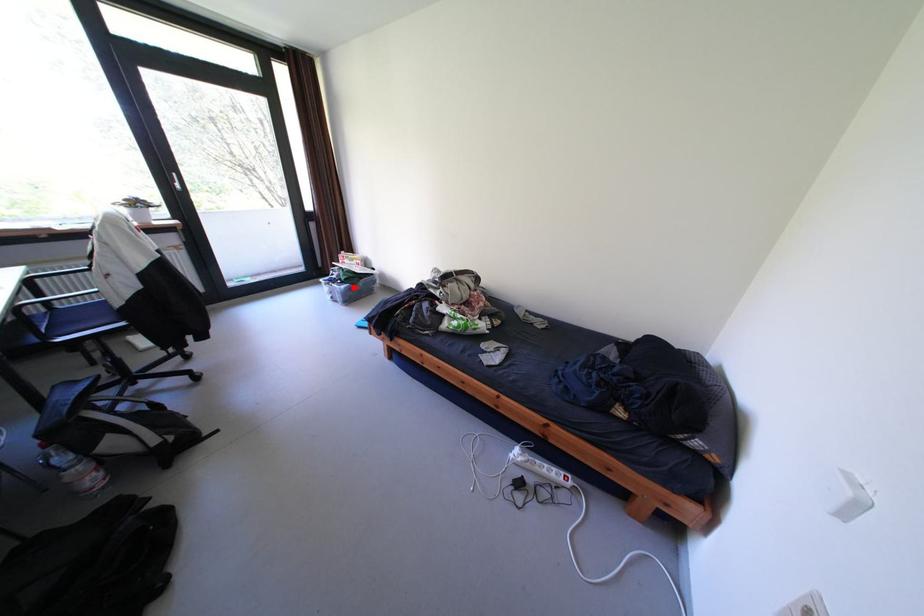
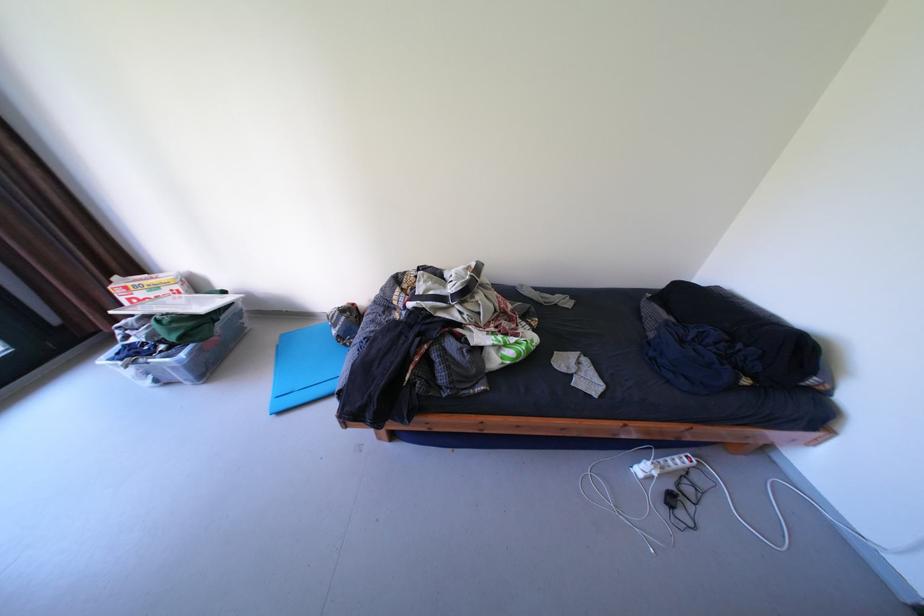
Question: I am providing you with two images of the same scene from different viewpoints. Image1 has a red point marked. In image2, the corresponding 3D location appears at what relative position? Reply with the corresponding letter.

Choices:
 (A) Closer
 (B) Farther

Answer: (A)